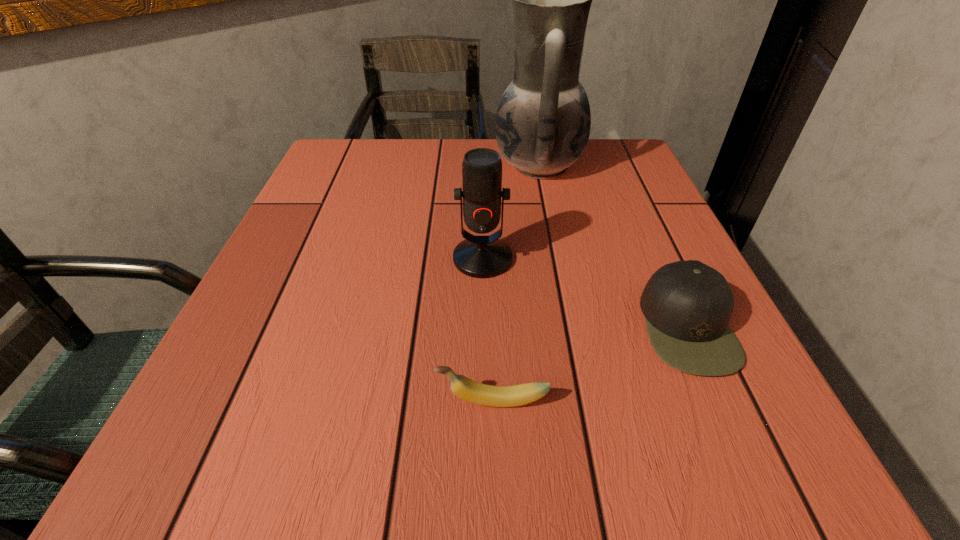
The height and width of the screenshot is (540, 960). I want to click on cap that is at the right edge, so click(687, 305).

This screenshot has height=540, width=960. Identify the location of object situated at the far right corner. (543, 120).

You are a GUI agent. You are given a task and a screenshot of the screen. Output one action in this format:
    pyautogui.click(x=<x>, y=<y>)
    Task: Click on the free space at the far edge of the desktop
    
    Given the screenshot: What is the action you would take?
    pyautogui.click(x=489, y=147)

Identify the location of free space at the near edge of the desktop. The width and height of the screenshot is (960, 540). (387, 425).

Find the location of a particular element. The height and width of the screenshot is (540, 960). free space at the left edge is located at coordinates (289, 417).

In the image, there is a desktop. Find the location of `vacant space at the right edge`. vacant space at the right edge is located at coordinates click(x=626, y=226).

The width and height of the screenshot is (960, 540). I want to click on vacant space at the near right corner of the desktop, so click(693, 483).

You are a GUI agent. You are given a task and a screenshot of the screen. Output one action in this format:
    pyautogui.click(x=<x>, y=<y>)
    Task: Click on the free spot between the tallest object and the nearest object
    
    Given the screenshot: What is the action you would take?
    pyautogui.click(x=516, y=284)

Locate an element on the screen. empty space that is in between the rightmost object and the tallest object is located at coordinates (612, 246).

This screenshot has width=960, height=540. Find the location of `vacant region between the second tallest object and the second nearest object`. vacant region between the second tallest object and the second nearest object is located at coordinates tap(585, 293).